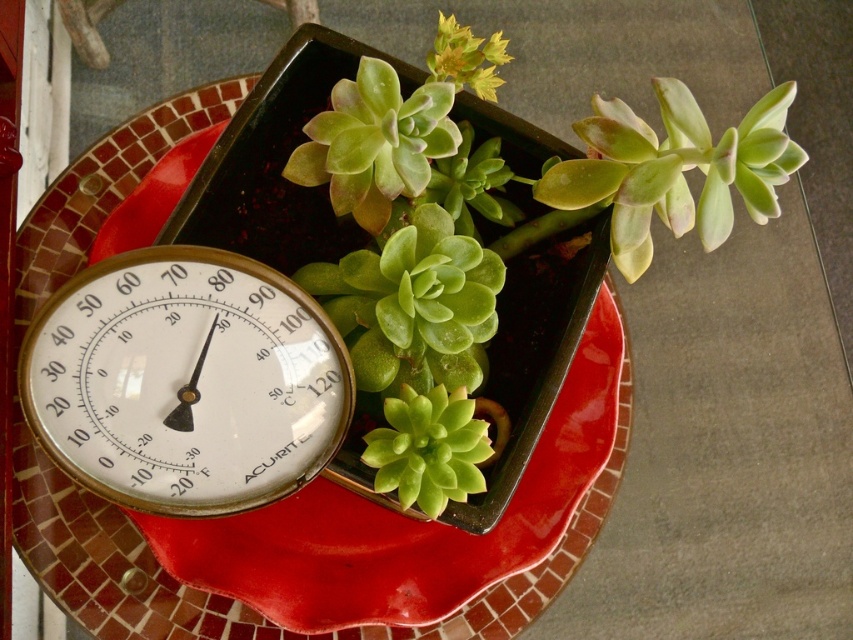
Question: Can you confirm if matte ceramic platter at center is positioned above pale green succulent at upper right?

Choices:
 (A) no
 (B) yes

Answer: (A)

Question: Is gold metallic thermometer at lower left below green succulent at center?

Choices:
 (A) no
 (B) yes

Answer: (A)

Question: Which point is closer to the camera?

Choices:
 (A) gold metallic thermometer at lower left
 (B) green succulent at center

Answer: (A)

Question: Is gold metallic thermometer at lower left bigger than pale green succulent at upper right?

Choices:
 (A) no
 (B) yes

Answer: (A)

Question: Which object is the farthest from the matte ceramic platter at center?

Choices:
 (A) gold metallic thermometer at lower left
 (B) pale green succulent at upper right

Answer: (B)

Question: Which object is closer to the camera taking this photo?

Choices:
 (A) green succulent at center
 (B) gold metallic thermometer at lower left
 (C) pale green succulent at upper right
 (D) matte ceramic platter at center

Answer: (B)